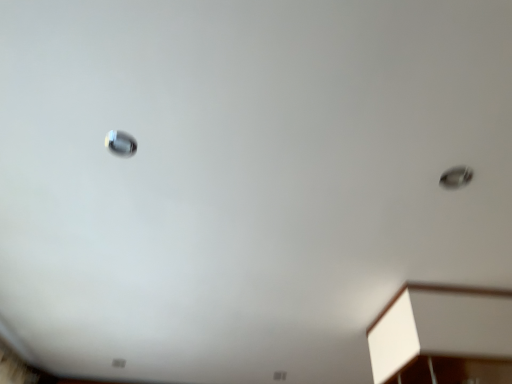
Question: Is white matte cabinet at lower right not within satin silver droplight at upper left, positioned as the first droplight in front-to-back order?

Choices:
 (A) yes
 (B) no

Answer: (A)

Question: From the image's perspective, is white matte cabinet at lower right below satin silver droplight at upper left, positioned as the first droplight in front-to-back order?

Choices:
 (A) no
 (B) yes

Answer: (B)

Question: Does white matte cabinet at lower right lie in front of satin silver droplight at upper left, the 2th droplight positioned from the back?

Choices:
 (A) yes
 (B) no

Answer: (B)

Question: Considering the relative sizes of white matte cabinet at lower right and satin silver droplight at upper left, positioned as the 2th droplight in bottom-to-top order, in the image provided, is white matte cabinet at lower right smaller than satin silver droplight at upper left, positioned as the 2th droplight in bottom-to-top order,?

Choices:
 (A) no
 (B) yes

Answer: (A)

Question: Is white matte cabinet at lower right bigger than satin silver droplight at upper left, positioned as the first droplight in front-to-back order?

Choices:
 (A) yes
 (B) no

Answer: (A)

Question: Does white matte cabinet at lower right have a lesser width compared to satin silver droplight at upper left, positioned as the 2th droplight in right-to-left order?

Choices:
 (A) no
 (B) yes

Answer: (A)

Question: Would you consider satin silver droplight at upper left, the 2th droplight positioned from the back, to be distant from metallic silver droplight at upper right, acting as the first droplight starting from the bottom?

Choices:
 (A) no
 (B) yes

Answer: (A)

Question: From a real-world perspective, is satin silver droplight at upper left, marked as the first droplight in a left-to-right arrangement, beneath metallic silver droplight at upper right, which is counted as the first droplight, starting from the right?

Choices:
 (A) yes
 (B) no

Answer: (B)

Question: Does satin silver droplight at upper left, positioned as the 2th droplight in bottom-to-top order, appear on the left side of metallic silver droplight at upper right, arranged as the 1th droplight when viewed from the back?

Choices:
 (A) yes
 (B) no

Answer: (A)

Question: Is satin silver droplight at upper left, marked as the first droplight in a left-to-right arrangement, closer to camera compared to metallic silver droplight at upper right, which is the 2th droplight in front-to-back order?

Choices:
 (A) yes
 (B) no

Answer: (A)

Question: Is satin silver droplight at upper left, which ranks as the first droplight in top-to-bottom order, oriented towards metallic silver droplight at upper right, which is counted as the 2th droplight, starting from the left?

Choices:
 (A) no
 (B) yes

Answer: (B)

Question: Is satin silver droplight at upper left, positioned as the 2th droplight in right-to-left order, not inside metallic silver droplight at upper right, which is counted as the first droplight, starting from the right?

Choices:
 (A) yes
 (B) no

Answer: (A)

Question: Does metallic silver droplight at upper right, which is counted as the 2th droplight, starting from the top, appear on the right side of white matte cabinet at lower right?

Choices:
 (A) yes
 (B) no

Answer: (B)